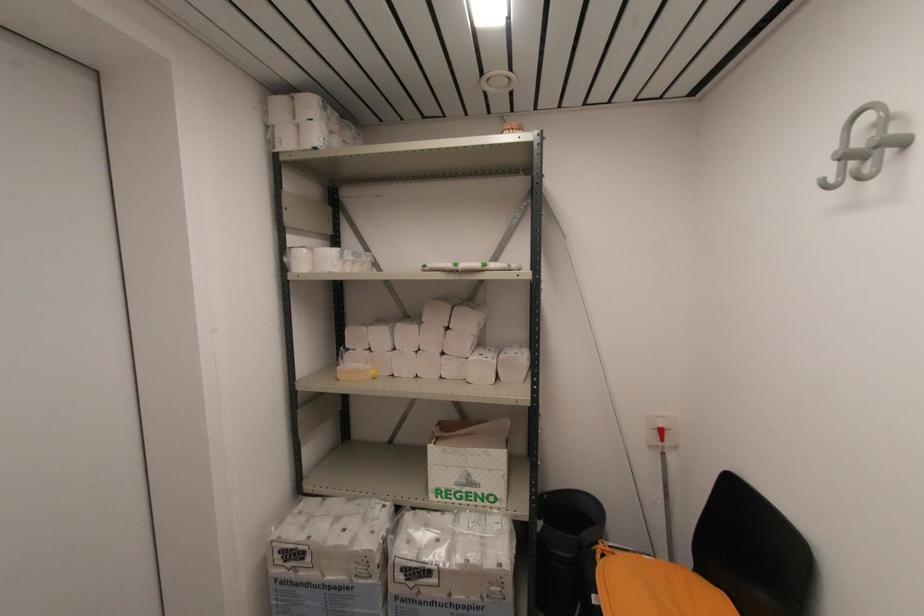
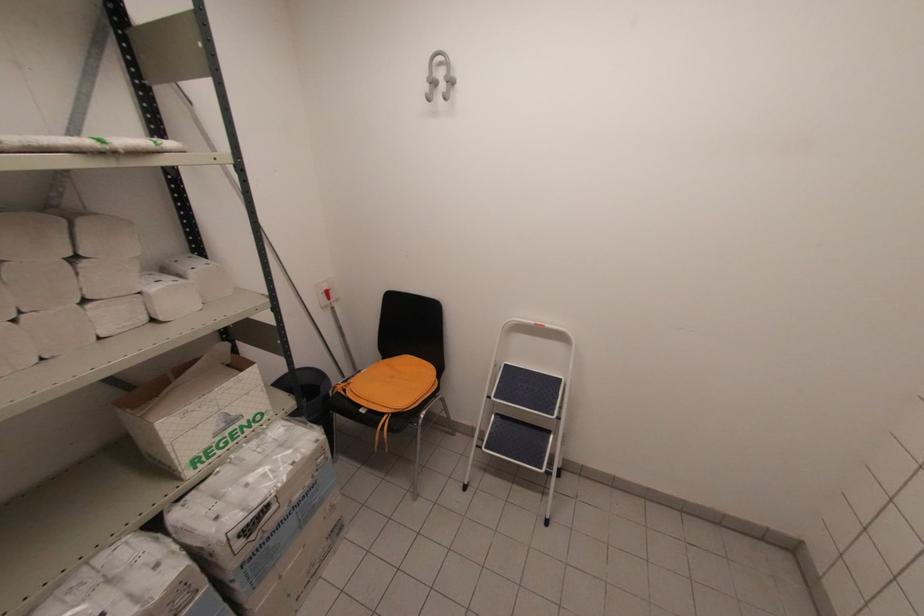
Where in the second image is the point corresponding to (x=511, y=570) from the first image?

(325, 437)